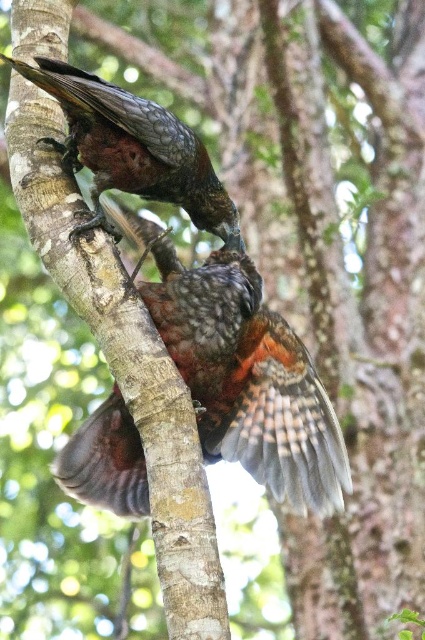
Question: Among these objects, which one is nearest to the camera?

Choices:
 (A) shiny brown feathers at upper center
 (B) shiny brown feathers at center

Answer: (A)

Question: Can you confirm if shiny brown feathers at center is smaller than shiny brown feathers at upper center?

Choices:
 (A) yes
 (B) no

Answer: (B)

Question: Can you confirm if shiny brown feathers at center is thinner than shiny brown feathers at upper center?

Choices:
 (A) no
 (B) yes

Answer: (A)

Question: Among these objects, which one is farthest from the camera?

Choices:
 (A) shiny brown feathers at center
 (B) shiny brown feathers at upper center

Answer: (A)

Question: Where is shiny brown feathers at center located in relation to shiny brown feathers at upper center in the image?

Choices:
 (A) below
 (B) above

Answer: (A)